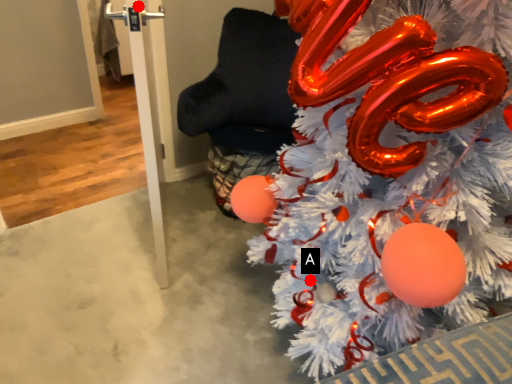
Question: Two points are circled on the image, labeled by A and B beside each circle. Which point is closer to the camera?

Choices:
 (A) A is closer
 (B) B is closer

Answer: (B)